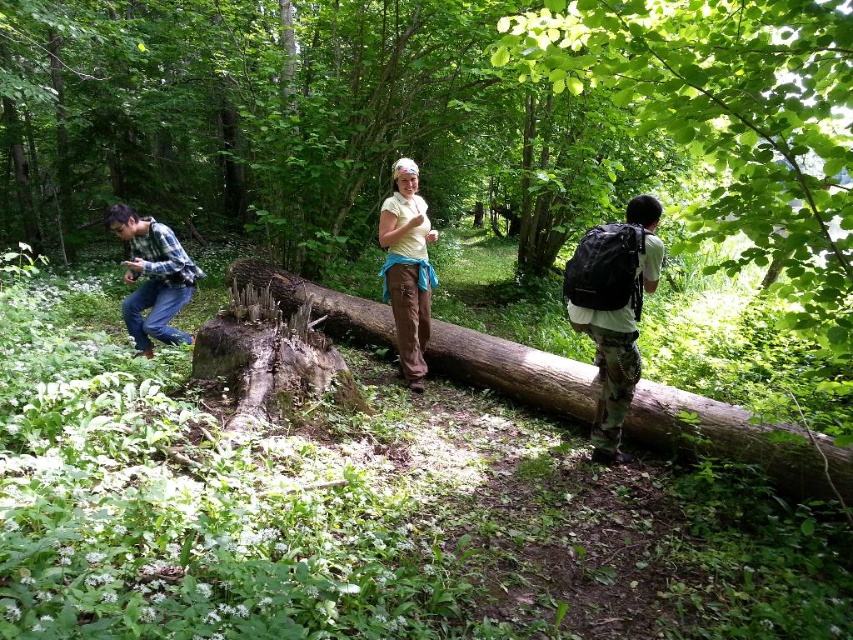
Between yellow t-shirt at center and yellow matte shirt at center, which one is positioned higher?

yellow matte shirt at center is above.

Which is behind, point (415, 252) or point (416, 340)?

The point (416, 340) is more distant.

Where is `yellow t-shirt at center`? This screenshot has height=640, width=853. yellow t-shirt at center is located at coordinates (614, 308).

Does point (630, 324) come behind point (149, 296)?

No, it is not.

Looking at this image, between yellow t-shirt at center and brushed metal camera at left, which one has more height?

With more height is yellow t-shirt at center.

This screenshot has width=853, height=640. Identify the location of yellow t-shirt at center. (614, 308).

Is the position of brown rough log at center more distant than that of brushed metal camera at left?

That is True.

Which is behind, point (515, 342) or point (171, 241)?

The point (515, 342) is behind.

Where is `brown rough log at center`? The image size is (853, 640). brown rough log at center is located at coordinates (740, 440).